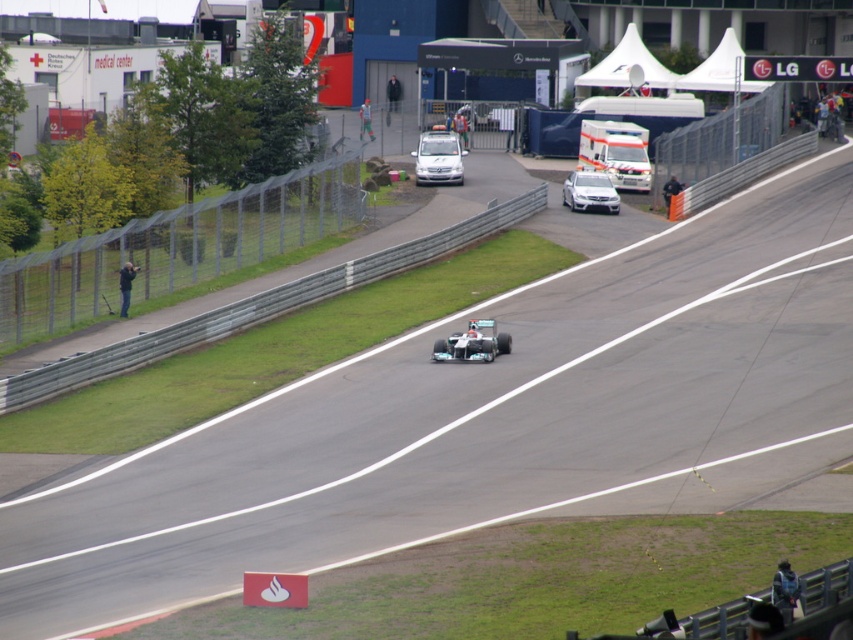
Between point (444, 168) and point (572, 198), which one is positioned behind?

Positioned behind is point (444, 168).

You are a GUI agent. You are given a task and a screenshot of the screen. Output one action in this format:
    pyautogui.click(x=<x>, y=<y>)
    Task: Click on the white matte van at center
    
    Given the screenshot: What is the action you would take?
    pyautogui.click(x=438, y=157)

The image size is (853, 640). What do you see at coordinates (473, 342) in the screenshot?
I see `white matte race car at center` at bounding box center [473, 342].

Between white matte race car at center and satin silver sedan at center, which one appears on the right side from the viewer's perspective?

satin silver sedan at center is more to the right.

You are a GUI agent. You are given a task and a screenshot of the screen. Output one action in this format:
    pyautogui.click(x=<x>, y=<y>)
    Task: Click on the white matte race car at center
    
    Given the screenshot: What is the action you would take?
    pyautogui.click(x=473, y=342)

Where is `white matte race car at center`? This screenshot has width=853, height=640. white matte race car at center is located at coordinates (473, 342).

Consider the image. Does white matte van at center appear on the right side of white matte race car at center?

No, white matte van at center is not to the right of white matte race car at center.

Measure the distance between point [430,145] and camera.

89.16 meters

Between point (434, 170) and point (469, 349), which one is positioned behind?

The point (434, 170) is behind.

Where is `white matte van at center`? The height and width of the screenshot is (640, 853). white matte van at center is located at coordinates (438, 157).